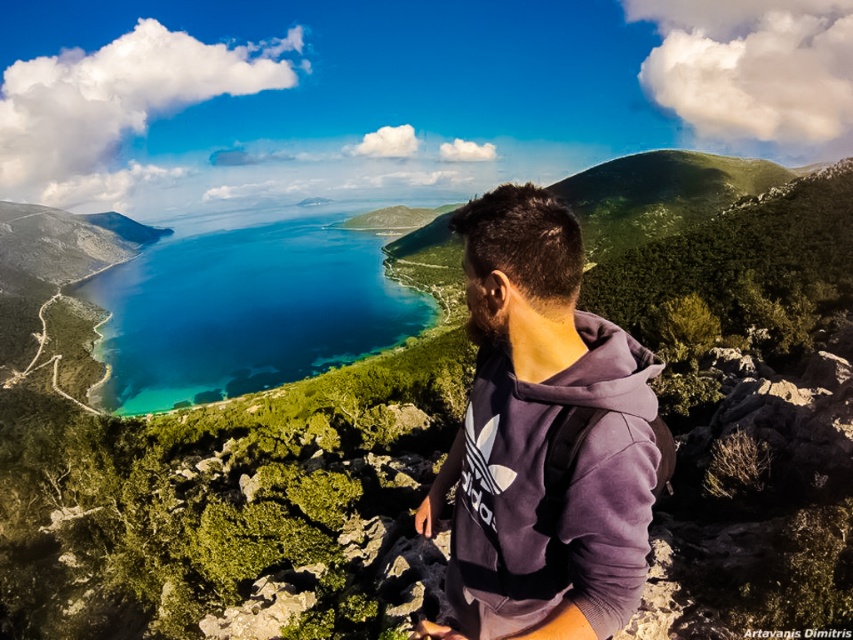
Question: Can you confirm if purple fleece jacket at center is positioned above blue crystal clear water at center?

Choices:
 (A) yes
 (B) no

Answer: (B)

Question: Among these points, which one is farthest from the camera?

Choices:
 (A) click(x=398, y=317)
 (B) click(x=492, y=604)

Answer: (A)

Question: Which object appears closest to the camera in this image?

Choices:
 (A) purple fleece jacket at center
 (B) blue crystal clear water at center

Answer: (A)

Question: Can you confirm if purple fleece jacket at center is bigger than blue crystal clear water at center?

Choices:
 (A) yes
 (B) no

Answer: (B)

Question: Which point is closer to the camera?

Choices:
 (A) blue crystal clear water at center
 (B) purple fleece jacket at center

Answer: (B)

Question: Does purple fleece jacket at center appear on the left side of blue crystal clear water at center?

Choices:
 (A) yes
 (B) no

Answer: (B)